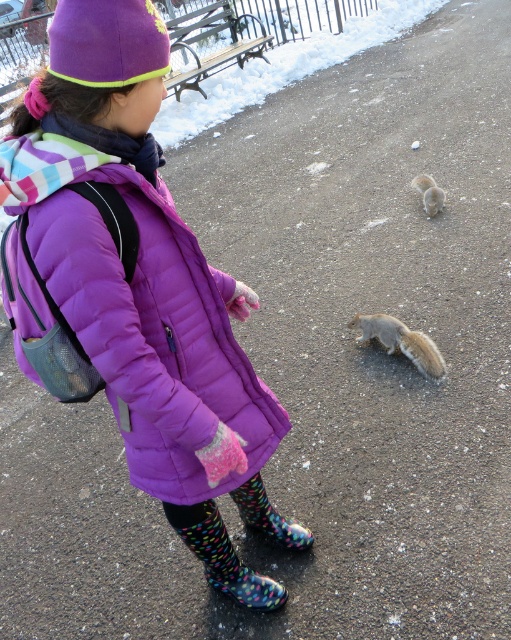
Question: Among these points, which one is nearest to the camera?

Choices:
 (A) (268, 515)
 (B) (407, 342)

Answer: (A)

Question: Among these objects, which one is farthest from the camera?

Choices:
 (A) polka dot rubber boot at lower center
 (B) fuzzy gray squirrel at lower center
 (C) gray furry squirrel at center

Answer: (B)

Question: Is purple quilted coat at center closer to camera compared to multicolored rubber boot at lower center?

Choices:
 (A) yes
 (B) no

Answer: (A)

Question: Can you confirm if multicolored rubber boot at lower center is wider than fuzzy gray squirrel at lower center?

Choices:
 (A) no
 (B) yes

Answer: (B)

Question: Which of these objects is positioned closest to the polka dot rubber boot at lower center?

Choices:
 (A) fuzzy gray squirrel at lower center
 (B) gray furry squirrel at center

Answer: (B)

Question: Does purple quilted coat at center appear on the right side of fuzzy gray squirrel at lower center?

Choices:
 (A) yes
 (B) no

Answer: (B)